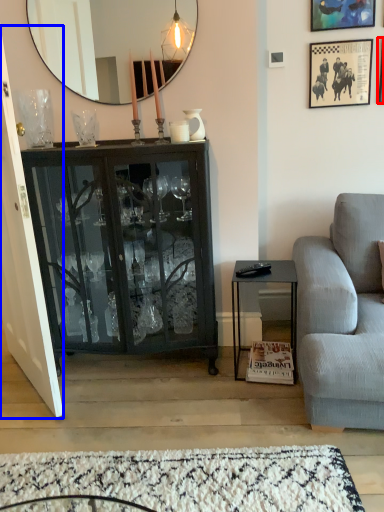
Question: Which of the following is the farthest to the observer, picture frame (highlighted by a red box) or door (highlighted by a blue box)?

Choices:
 (A) picture frame
 (B) door

Answer: (A)